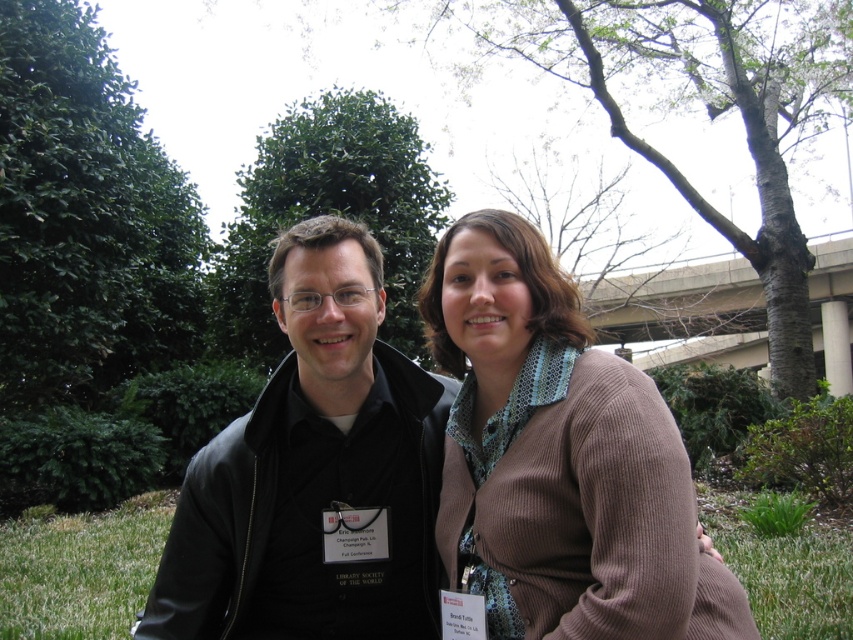
Does black leather jacket at center have a lesser height compared to brown corduroy sweater at center?

No, black leather jacket at center is not shorter than brown corduroy sweater at center.

Does black leather jacket at center have a greater width compared to brown corduroy sweater at center?

Yes, black leather jacket at center is wider than brown corduroy sweater at center.

I want to click on black leather jacket at center, so click(314, 472).

Between brown corduroy sweater at center and green leafy tree at center, which one has more height?

With more height is green leafy tree at center.

What are the coordinates of `brown corduroy sweater at center` in the screenshot? It's located at (550, 451).

I want to click on brown corduroy sweater at center, so click(x=550, y=451).

Find the location of a particular element. The height and width of the screenshot is (640, 853). brown corduroy sweater at center is located at coordinates (550, 451).

Can you confirm if green leafy tree at upper left is positioned to the left of green leafy tree at center?

Yes, green leafy tree at upper left is to the left of green leafy tree at center.

Who is more distant from viewer, (128, 314) or (405, 220)?

Point (128, 314)

The height and width of the screenshot is (640, 853). What are the coordinates of `green leafy tree at upper left` in the screenshot? It's located at (85, 216).